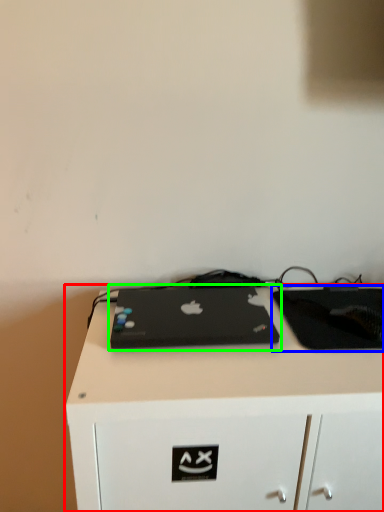
Question: Based on their relative distances, which object is farther from desk (highlighted by a red box)? Choose from tablet computer (highlighted by a blue box) and laptop (highlighted by a green box).

Choices:
 (A) tablet computer
 (B) laptop

Answer: (A)